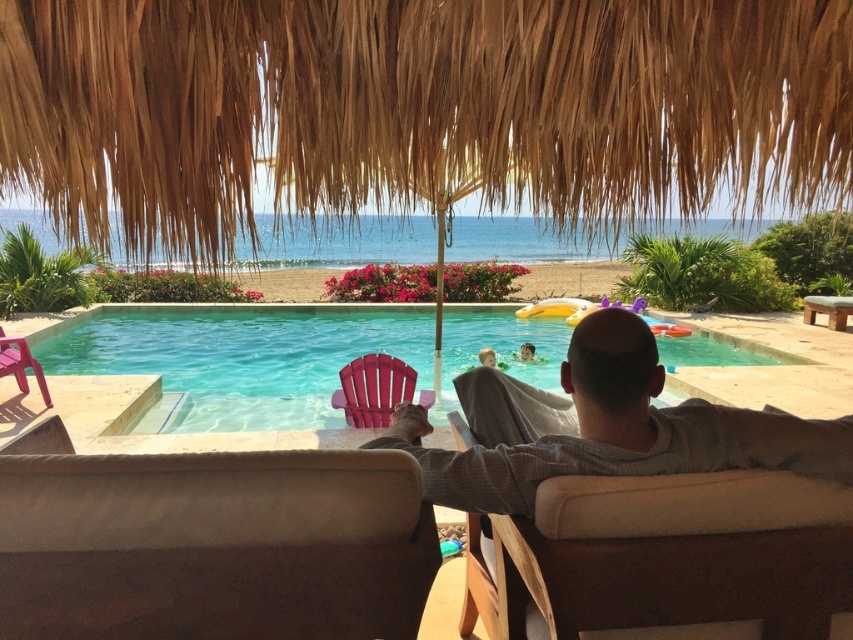
Question: Which object appears farthest from the camera in this image?

Choices:
 (A) clear blue water at center
 (B) plastic beach chair at lower left

Answer: (B)

Question: Can you confirm if plastic beach chair at lower left is thinner than smooth blonde hair at upper center?

Choices:
 (A) no
 (B) yes

Answer: (A)

Question: Considering the relative positions of beige fabric beach chair at center and matte pink beach chair at center in the image provided, where is beige fabric beach chair at center located with respect to matte pink beach chair at center?

Choices:
 (A) above
 (B) below

Answer: (B)

Question: Based on their relative distances, which object is farther from the smooth blonde hair at upper center?

Choices:
 (A) smooth skin head at upper center
 (B) plastic beach chair at lower left

Answer: (B)

Question: Is gray cotton shirt at center to the right of smooth skin head at upper center from the viewer's perspective?

Choices:
 (A) no
 (B) yes

Answer: (A)

Question: Among these points, which one is nearest to the camera?

Choices:
 (A) (479, 355)
 (B) (531, 356)

Answer: (A)